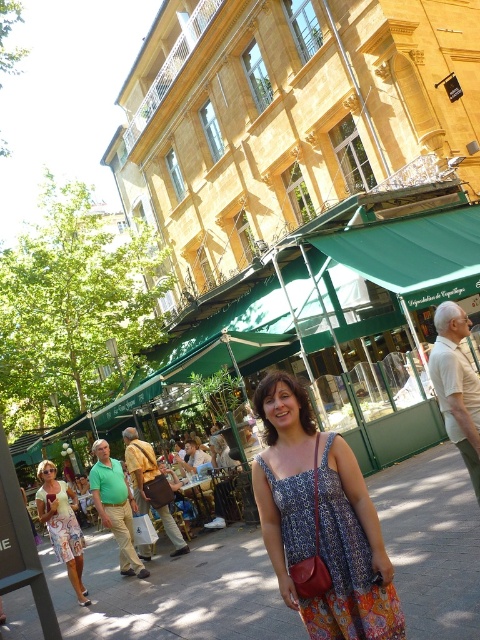
You are a photographer trying to capture the entire scene of the concrete pavement at center and the floral print fabric dress at lower left. Considering their sizes, which object should you focus on to ensure both are visible in the frame?

The concrete pavement at center has a larger size compared to the floral print fabric dress at lower left. To ensure both are visible in the frame, focus on the larger object, the concrete pavement at center, as it occupies more space and will help balance the composition with the smaller floral print fabric dress at lower left.